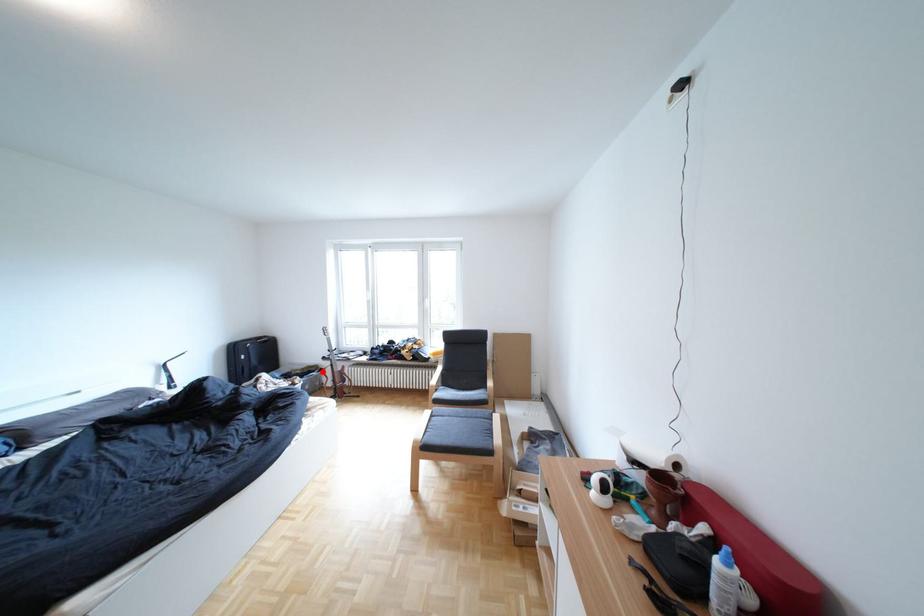
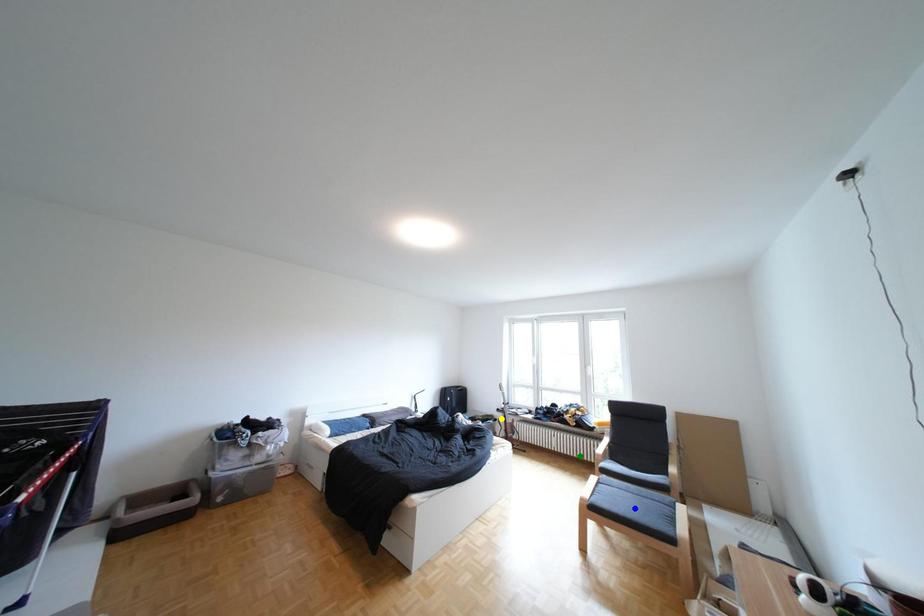
Question: I am providing you with two images of the same scene from different viewpoints. A red point is marked on the first image. You are given multiple points on the second image. Which spot in image 2 lines up with the point in image 1?

Choices:
 (A) blue point
 (B) green point
 (C) yellow point

Answer: (C)